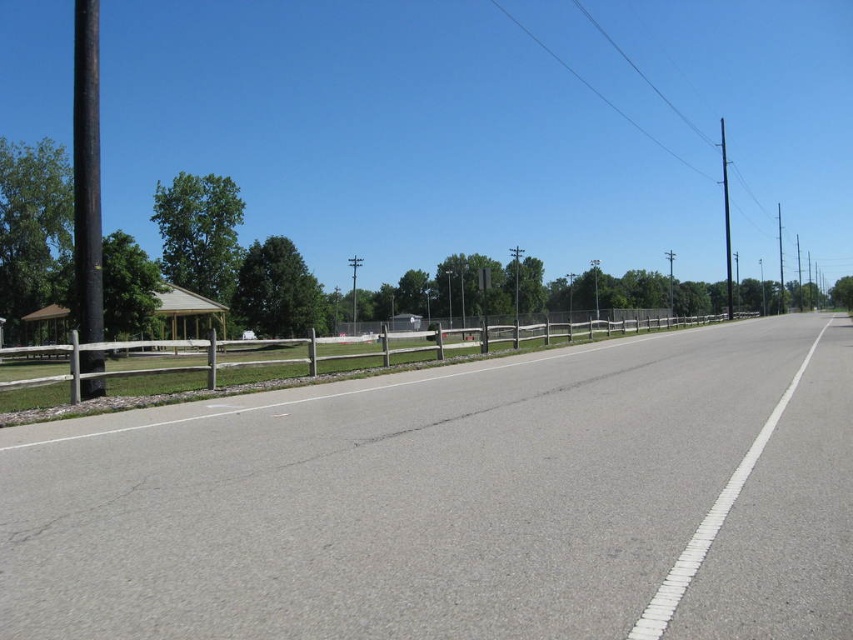
Based on the photo, between black matte pole at left and metallic pole at right, which one has more height?

Standing taller between the two is metallic pole at right.

Is black matte pole at left positioned behind metallic pole at right?

No.

Is point (91, 250) more distant than point (779, 262)?

No, it is not.

The image size is (853, 640). I want to click on black matte pole at left, so click(86, 172).

From the picture: Does brown wooden fence at left have a larger size compared to black matte pole at left?

No, brown wooden fence at left is not bigger than black matte pole at left.

Is point (318, 365) positioned in front of point (86, 371)?

No, it is behind (86, 371).

Locate an element on the screen. This screenshot has width=853, height=640. brown wooden fence at left is located at coordinates pos(276,364).

Can you confirm if brown wooden fence at left is bigger than black metallic pole at right?

Actually, brown wooden fence at left might be smaller than black metallic pole at right.

Is brown wooden fence at left to the right of black metallic pole at right from the viewer's perspective?

Incorrect, brown wooden fence at left is not on the right side of black metallic pole at right.

Which is behind, point (305, 362) or point (727, 305)?

Positioned behind is point (727, 305).

Identify the location of brown wooden fence at left. The image size is (853, 640). (276, 364).